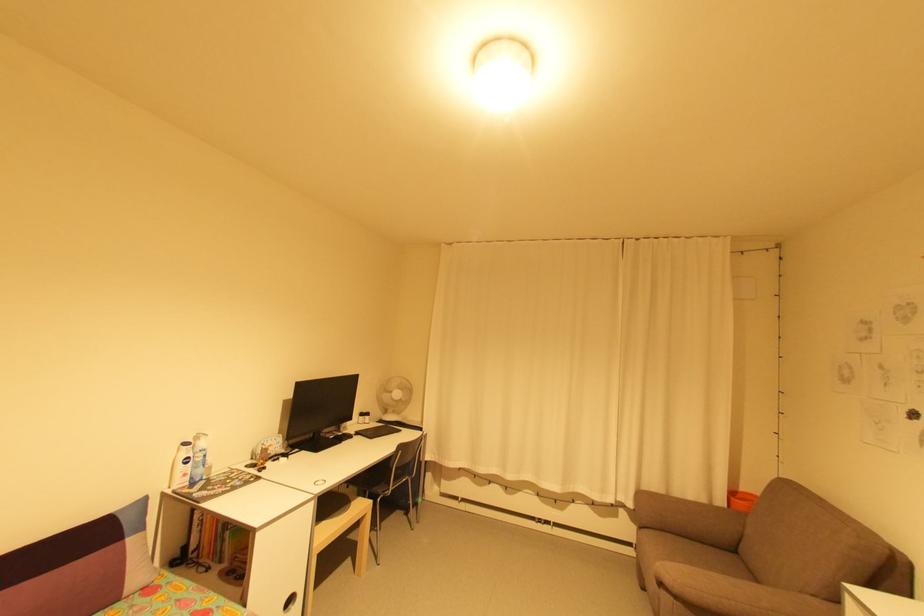
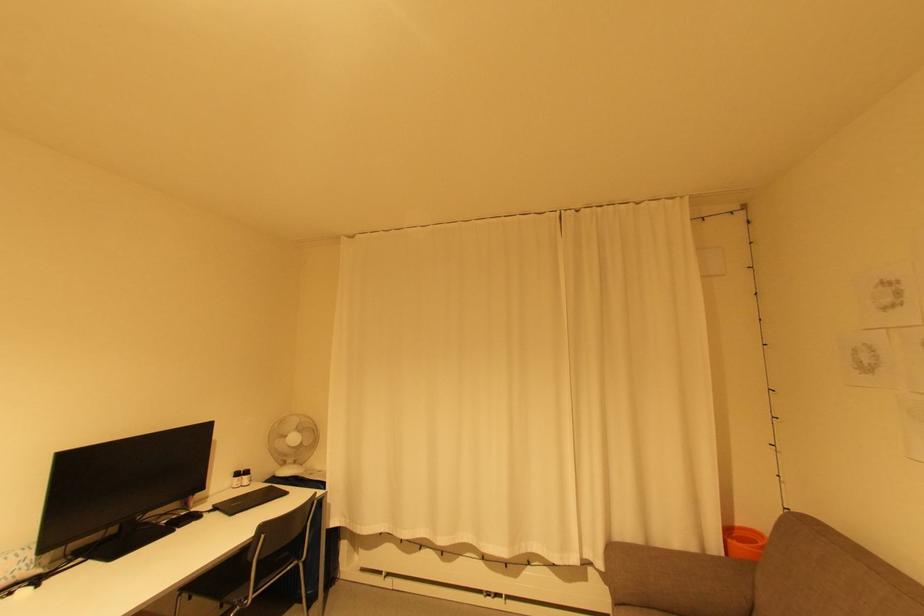
The point at (x=402, y=394) is marked in the first image. Where is the corresponding point in the second image?

(298, 439)